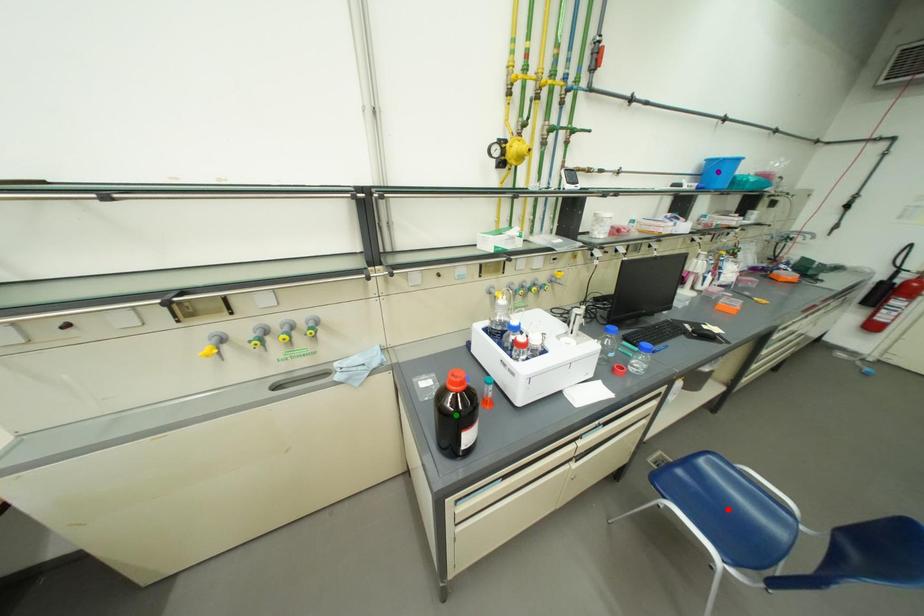
Order these from nearest to farthest:
A) green point
B) red point
C) purple point

green point, red point, purple point